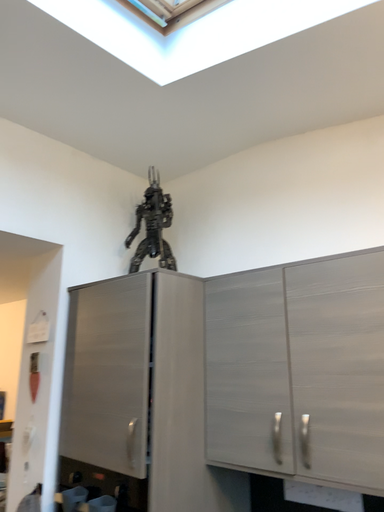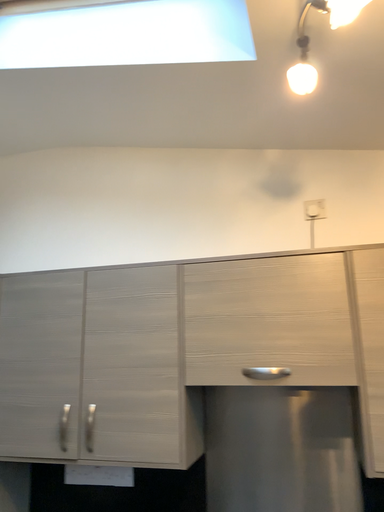
Question: How did the camera likely rotate when shooting the video?

Choices:
 (A) rotated left
 (B) rotated right

Answer: (B)